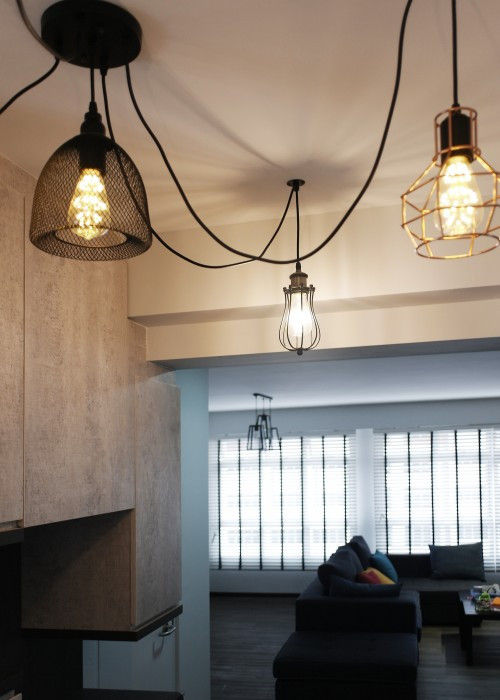
Find the location of a particular element. dark grey couch is located at coordinates (418, 582).